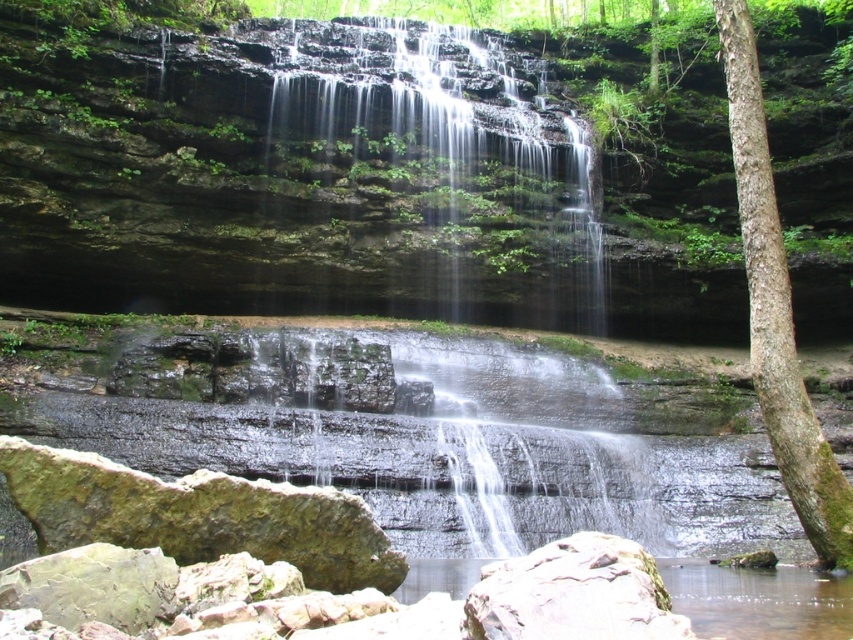
You are a hiker who wants to cross the waterfall area safely. There is a point marked at coordinates point (437, 173). What is the safest path to take to avoid getting wet?

The point (437, 173) is on translucent rock waterfall at center, so the safest path would be to stay on the solid ground around the waterfall to avoid getting wet.

You are a hiker who wants to cross from the green rough bark tree at right to the smooth gray rock at lower center. The path between them is 14.92 meters. If your backpack weighs 15 kilograms, will the distance affect your ability to make the journey?

The distance between the green rough bark tree at right and the smooth gray rock at lower center is 14.92 meters. Since the backpack weighs 15 kilograms, the distance alone does not prevent you from making the journey, but it may require more effort due to the weight and the terrain.

You are standing at the base of the waterfall and want to place a small statue on the smooth gray rock at lower center. However, there is a green rough bark tree at right nearby. Is the statue likely to be visible from your current position?

The green rough bark tree at right is above the smooth gray rock at lower center, so the statue placed on the smooth gray rock at lower center might be partially obscured by the tree, making it less visible from your current position at the base of the waterfall.